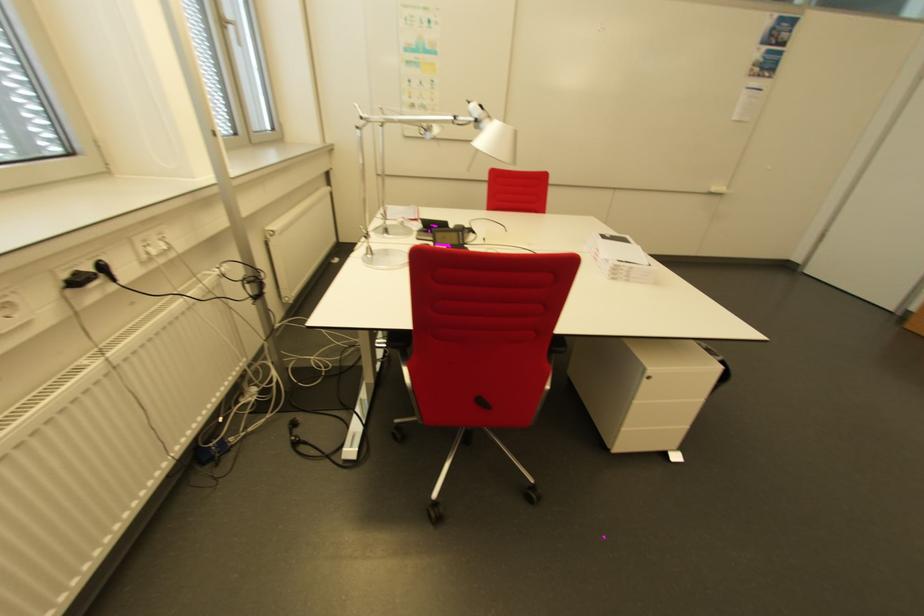
Which object does [621,257] point to?

This point indicates the white booklet.